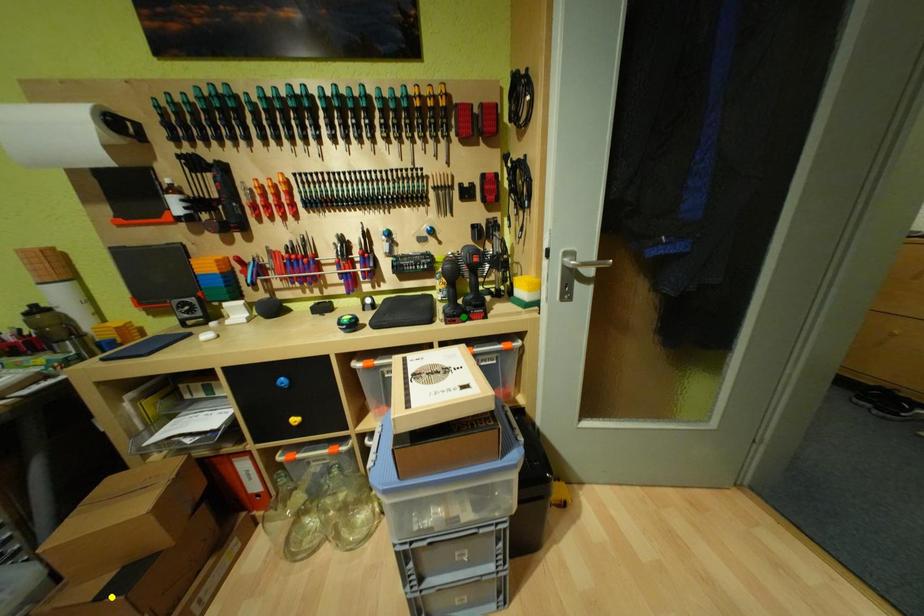
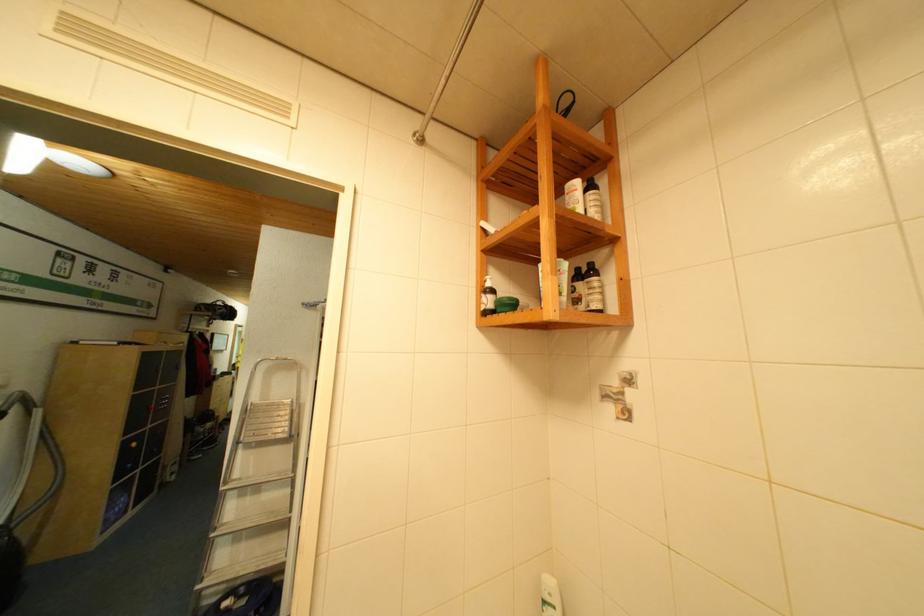
I am providing you with two images of the same scene from different viewpoints. Three points are marked in image1. Which point corresponds to a part or object that is occluded in image2?In image1, three points are marked. Which of them correspond to a part or object that is occluded in image2?Among the three points shown in image1, which one corresponds to a part or object that is no longer visible due to occlusion in image2?

yellow point, blue point, green point